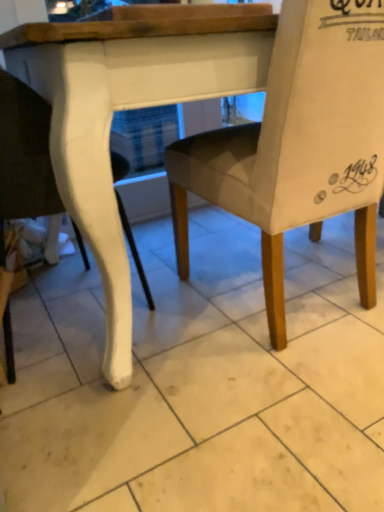
Question: In terms of height, does white glossy chair leg at left, which ranks as the 1th chair in left-to-right order, look taller or shorter compared to light gray fabric chair at center, the second chair in the left-to-right sequence?

Choices:
 (A) short
 (B) tall

Answer: (B)

Question: Considering the positions of white glossy chair leg at left, the 2th chair positioned from the right, and light gray fabric chair at center, which appears as the first chair when viewed from the right, in the image, is white glossy chair leg at left, the 2th chair positioned from the right, wider or thinner than light gray fabric chair at center, which appears as the first chair when viewed from the right,?

Choices:
 (A) thin
 (B) wide

Answer: (A)

Question: Considering the real-world distances, which object is closest to the light gray fabric chair at center, which appears as the first chair when viewed from the right?

Choices:
 (A) white glossy tile at center
 (B) white glossy chair leg at left, the 2th chair positioned from the right

Answer: (A)

Question: Considering the real-world distances, which object is farthest from the light gray fabric chair at center, which appears as the first chair when viewed from the right?

Choices:
 (A) white glossy tile at center
 (B) white glossy chair leg at left, the 2th chair positioned from the right

Answer: (B)